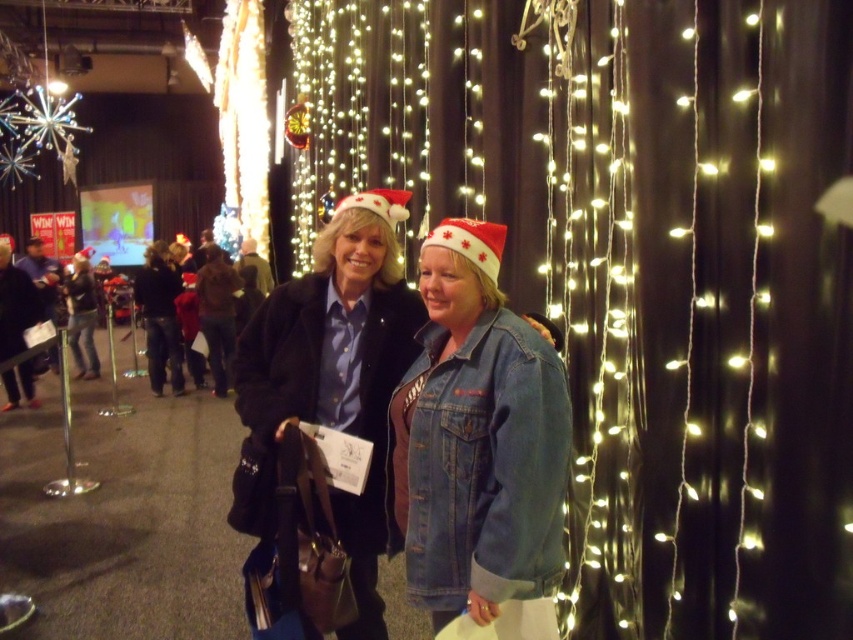
Does denim jacket at lower right have a lesser height compared to denim jacket at center?

Yes.

Does denim jacket at lower right appear on the right side of denim jacket at center?

Indeed, denim jacket at lower right is positioned on the right side of denim jacket at center.

Is point (463, 396) positioned behind point (260, 588)?

No, it is not.

Locate an element on the screen. This screenshot has height=640, width=853. denim jacket at lower right is located at coordinates (477, 436).